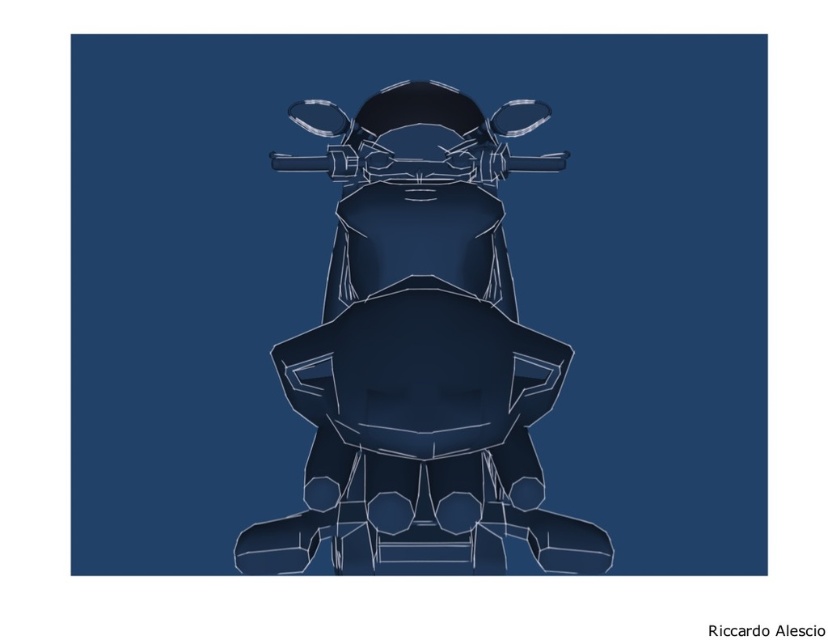
Question: Is matte dark blue motorcycle at center thinner than transparent plastic gun at center?

Choices:
 (A) no
 (B) yes

Answer: (A)

Question: Is matte dark blue motorcycle at center wider than transparent plastic gun at center?

Choices:
 (A) no
 (B) yes

Answer: (B)

Question: Is the position of matte dark blue motorcycle at center more distant than that of transparent plastic gun at center?

Choices:
 (A) yes
 (B) no

Answer: (B)